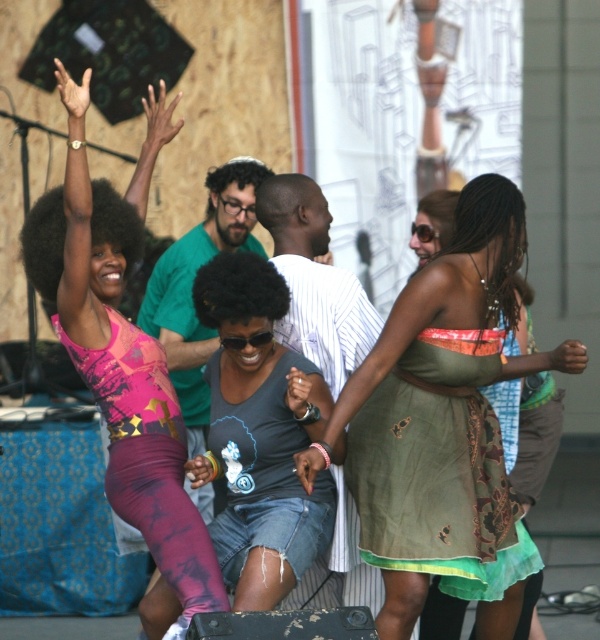
Question: Is green textured dress at center below denim shorts at center?

Choices:
 (A) yes
 (B) no

Answer: (B)

Question: Which point is closer to the camera taking this photo?

Choices:
 (A) (416, 429)
 (B) (270, 392)
 (C) (138, 396)

Answer: (C)

Question: Which of the following is the closest to the observer?

Choices:
 (A) green textured dress at center
 (B) denim shorts at center
 (C) pink mesh tank top at upper left

Answer: (C)

Question: Considering the relative positions of green textured dress at center and denim shorts at center in the image provided, where is green textured dress at center located with respect to denim shorts at center?

Choices:
 (A) left
 (B) right

Answer: (B)

Question: Does green textured dress at center appear under denim shorts at center?

Choices:
 (A) no
 (B) yes

Answer: (A)

Question: Which point appears farthest from the camera in this image?

Choices:
 (A) pyautogui.click(x=457, y=212)
 (B) pyautogui.click(x=208, y=572)

Answer: (A)